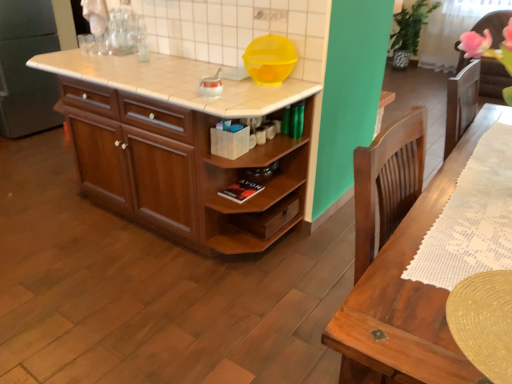
What do you see at coordinates (180, 170) in the screenshot?
I see `wooden cabinet at center` at bounding box center [180, 170].

What are the coordinates of `white glossy kettle at center, which ranks as the 2th appliance in right-to-left order` in the screenshot? It's located at pos(211,85).

Looking at this image, considering the sizes of objects yellow plastic bowl at upper center, the 1th appliance viewed from the right, and white glossy kettle at center, which is the first appliance in left-to-right order, in the image provided, who is thinner, yellow plastic bowl at upper center, the 1th appliance viewed from the right, or white glossy kettle at center, which is the first appliance in left-to-right order,?

With smaller width is white glossy kettle at center, which is the first appliance in left-to-right order.

How distant is yellow plastic bowl at upper center, which ranks as the second appliance in left-to-right order, from white glossy kettle at center, which ranks as the 2th appliance in right-to-left order?

A distance of 9.46 inches exists between yellow plastic bowl at upper center, which ranks as the second appliance in left-to-right order, and white glossy kettle at center, which ranks as the 2th appliance in right-to-left order.

How many degrees apart are the facing directions of yellow plastic bowl at upper center, the 1th appliance viewed from the right, and white glossy kettle at center, which is the first appliance in left-to-right order?

The angle between the facing direction of yellow plastic bowl at upper center, the 1th appliance viewed from the right, and the facing direction of white glossy kettle at center, which is the first appliance in left-to-right order, is 0.00266 degrees.

Is yellow plastic bowl at upper center, which ranks as the second appliance in left-to-right order, closer to camera compared to white glossy kettle at center, which is the first appliance in left-to-right order?

No, yellow plastic bowl at upper center, which ranks as the second appliance in left-to-right order, is behind white glossy kettle at center, which is the first appliance in left-to-right order.

Between point (182, 176) and point (264, 51), which one is positioned in front?

The point (264, 51) is closer.

Is wooden cabinet at center thinner than yellow plastic bowl at upper center, which ranks as the second appliance in left-to-right order?

Incorrect, the width of wooden cabinet at center is not less than that of yellow plastic bowl at upper center, which ranks as the second appliance in left-to-right order.

Which is more to the left, wooden cabinet at center or yellow plastic bowl at upper center, which ranks as the second appliance in left-to-right order?

From the viewer's perspective, wooden cabinet at center appears more on the left side.

Locate an element on the screen. The width and height of the screenshot is (512, 384). cabinetry in front of the yellow plastic bowl at upper center, which ranks as the second appliance in left-to-right order is located at coordinates (180, 170).

Is yellow plastic bowl at upper center, which ranks as the second appliance in left-to-right order, touching white tile countertop at center?

They are not placed beside each other.

From the image's perspective, which is below, yellow plastic bowl at upper center, which ranks as the second appliance in left-to-right order, or white tile countertop at center?

yellow plastic bowl at upper center, which ranks as the second appliance in left-to-right order, is shown below in the image.

Considering the relative positions of yellow plastic bowl at upper center, the 1th appliance viewed from the right, and white tile countertop at center in the image provided, is yellow plastic bowl at upper center, the 1th appliance viewed from the right, behind white tile countertop at center?

That is True.

Is yellow plastic bowl at upper center, which ranks as the second appliance in left-to-right order, oriented away from white tile countertop at center?

No.

In the image, is white tile countertop at center positioned in front of or behind wooden cabinet at center?

white tile countertop at center is positioned closer to the viewer than wooden cabinet at center.

The image size is (512, 384). Identify the location of cabinetry on the right of white tile countertop at center. (180, 170).

From the image's perspective, is white tile countertop at center located above or below wooden cabinet at center?

white tile countertop at center is situated higher than wooden cabinet at center in the image.

Does white tile countertop at center appear on the right side of yellow plastic bowl at upper center, the 1th appliance viewed from the right?

No.

Who is shorter, white tile countertop at center or yellow plastic bowl at upper center, the 1th appliance viewed from the right?

→ With less height is white tile countertop at center.

Considering the points (145, 67) and (257, 71), which point is behind, point (145, 67) or point (257, 71)?

The point (145, 67) is more distant.

Is white tile countertop at center placed right next to white glossy kettle at center, which is the first appliance in left-to-right order?

No, white tile countertop at center is not touching white glossy kettle at center, which is the first appliance in left-to-right order.

How many degrees apart are the facing directions of white tile countertop at center and white glossy kettle at center, which is the first appliance in left-to-right order?

The angular difference between white tile countertop at center and white glossy kettle at center, which is the first appliance in left-to-right order, is 0.00281 degrees.

Is point (132, 88) closer or farther from the camera than point (210, 96)?

Point (132, 88).

Looking at this image, can you confirm if white tile countertop at center is bigger than white glossy kettle at center, which is the first appliance in left-to-right order?

Correct, white tile countertop at center is larger in size than white glossy kettle at center, which is the first appliance in left-to-right order.

Which of these two, white glossy kettle at center, which is the first appliance in left-to-right order, or wooden cabinet at center, is thinner?

Thinner between the two is white glossy kettle at center, which is the first appliance in left-to-right order.

Is white glossy kettle at center, which is the first appliance in left-to-right order, completely or partially outside of wooden cabinet at center?

Yes.

From the image's perspective, between white glossy kettle at center, which ranks as the 2th appliance in right-to-left order, and wooden cabinet at center, who is located below?

From the image's view, wooden cabinet at center is below.

Is the surface of white glossy kettle at center, which ranks as the 2th appliance in right-to-left order, in direct contact with wooden cabinet at center?

white glossy kettle at center, which ranks as the 2th appliance in right-to-left order, and wooden cabinet at center are not in contact.

What are the coordinates of `appliance that is in front of the yellow plastic bowl at upper center, which ranks as the second appliance in left-to-right order` in the screenshot? It's located at (211, 85).

At what (x,y) coordinates should I click in order to perform the action: click on cabinetry located on the left of yellow plastic bowl at upper center, which ranks as the second appliance in left-to-right order. Please return your answer as a coordinate pair (x, y). The width and height of the screenshot is (512, 384). Looking at the image, I should click on (180, 170).

From the image, which object appears to be farther from yellow plastic bowl at upper center, which ranks as the second appliance in left-to-right order, wooden cabinet at center or white tile countertop at center?

wooden cabinet at center lies further to yellow plastic bowl at upper center, which ranks as the second appliance in left-to-right order, than the other object.

Based on the photo, from the image, which object appears to be farther from white tile countertop at center, yellow plastic bowl at upper center, which ranks as the second appliance in left-to-right order, or wooden cabinet at center?

The object further to white tile countertop at center is yellow plastic bowl at upper center, which ranks as the second appliance in left-to-right order.

From the picture: When comparing their distances from white tile countertop at center, does wooden cabinet at center or white glossy kettle at center, which ranks as the 2th appliance in right-to-left order, seem closer?

Based on the image, white glossy kettle at center, which ranks as the 2th appliance in right-to-left order, appears to be nearer to white tile countertop at center.

In the scene shown: When comparing their distances from yellow plastic bowl at upper center, which ranks as the second appliance in left-to-right order, does white glossy kettle at center, which is the first appliance in left-to-right order, or white tile countertop at center seem closer?

The object closer to yellow plastic bowl at upper center, which ranks as the second appliance in left-to-right order, is white glossy kettle at center, which is the first appliance in left-to-right order.

Based on their spatial positions, is white tile countertop at center or white glossy kettle at center, which is the first appliance in left-to-right order, closer to wooden cabinet at center?

white tile countertop at center lies closer to wooden cabinet at center than the other object.

When comparing their distances from yellow plastic bowl at upper center, which ranks as the second appliance in left-to-right order, does white tile countertop at center or white glossy kettle at center, which is the first appliance in left-to-right order, seem further?

Among the two, white tile countertop at center is located further to yellow plastic bowl at upper center, which ranks as the second appliance in left-to-right order.

When comparing their distances from yellow plastic bowl at upper center, the 1th appliance viewed from the right, does white glossy kettle at center, which is the first appliance in left-to-right order, or wooden cabinet at center seem closer?

white glossy kettle at center, which is the first appliance in left-to-right order, lies closer to yellow plastic bowl at upper center, the 1th appliance viewed from the right, than the other object.

Estimate the real-world distances between objects in this image. Which object is closer to white tile countertop at center, white glossy kettle at center, which ranks as the 2th appliance in right-to-left order, or yellow plastic bowl at upper center, which ranks as the second appliance in left-to-right order?

white glossy kettle at center, which ranks as the 2th appliance in right-to-left order, is positioned closer to the anchor white tile countertop at center.

At what (x,y) coordinates should I click in order to perform the action: click on cabinetry located between white tile countertop at center and yellow plastic bowl at upper center, which ranks as the second appliance in left-to-right order, in the left-right direction. Please return your answer as a coordinate pair (x, y). Image resolution: width=512 pixels, height=384 pixels. Looking at the image, I should click on (180, 170).

This screenshot has height=384, width=512. Find the location of `appliance situated between wooden cabinet at center and yellow plastic bowl at upper center, which ranks as the second appliance in left-to-right order, from left to right`. appliance situated between wooden cabinet at center and yellow plastic bowl at upper center, which ranks as the second appliance in left-to-right order, from left to right is located at coordinates (211, 85).

Locate an element on the screen. The width and height of the screenshot is (512, 384). appliance located between white tile countertop at center and yellow plastic bowl at upper center, which ranks as the second appliance in left-to-right order, in the left-right direction is located at coordinates (211, 85).

Where is `cabinetry between white tile countertop at center and white glossy kettle at center, which ranks as the 2th appliance in right-to-left order, in the horizontal direction`? This screenshot has width=512, height=384. cabinetry between white tile countertop at center and white glossy kettle at center, which ranks as the 2th appliance in right-to-left order, in the horizontal direction is located at coordinates (180, 170).